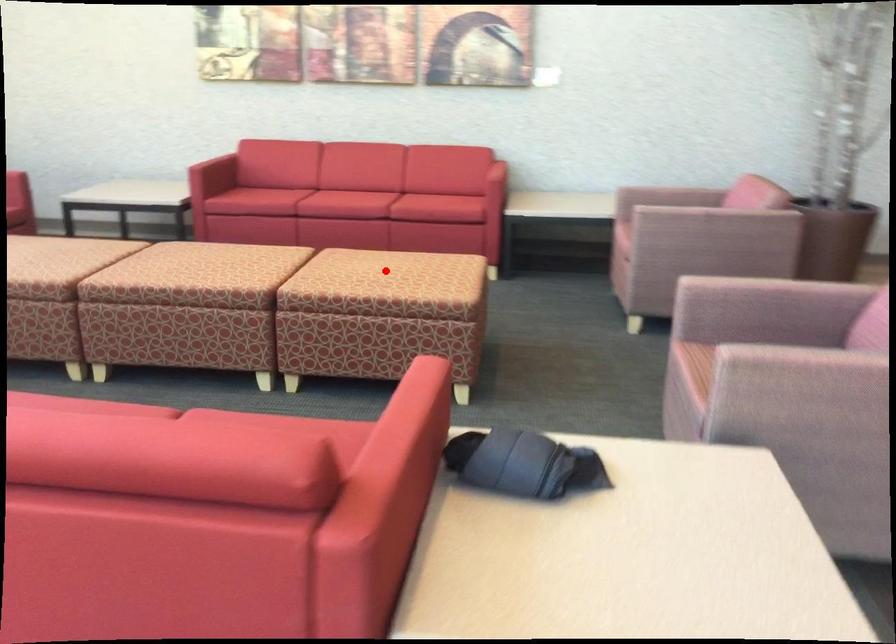
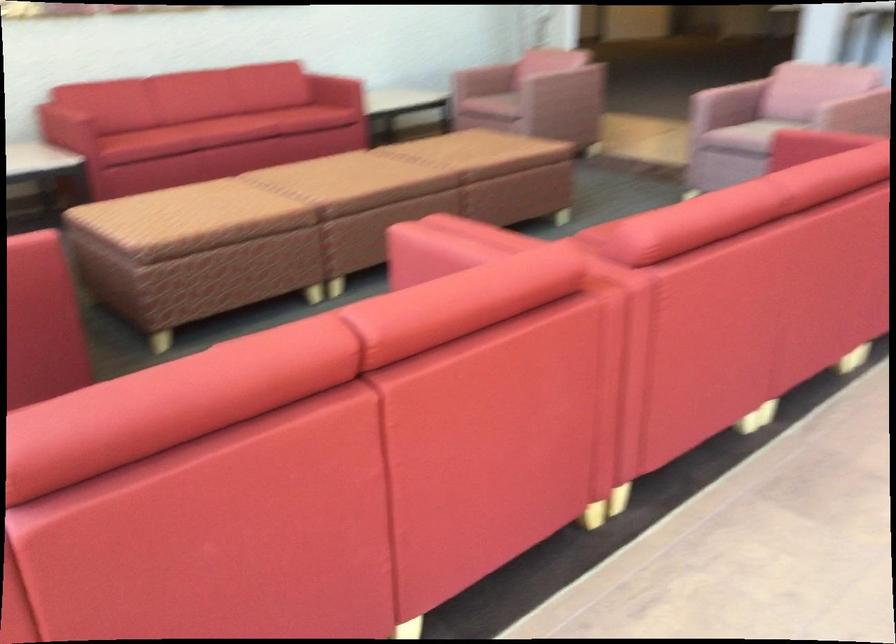
Question: I am providing you with two images of the same scene from different viewpoints. A red point is shown in image1. For the corresponding object point in image2, is it positioned nearer or farther from the camera?

Choices:
 (A) Nearer
 (B) Farther

Answer: (B)